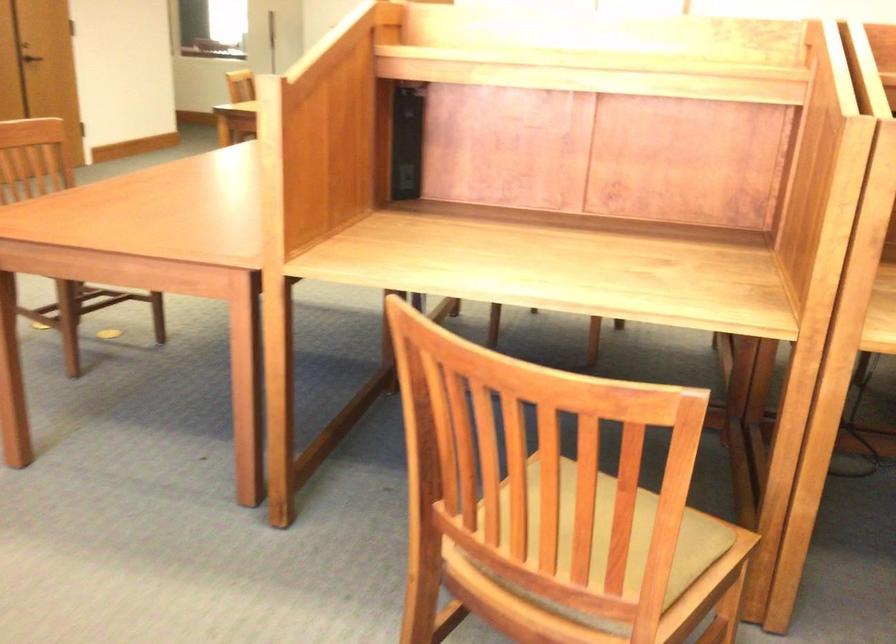
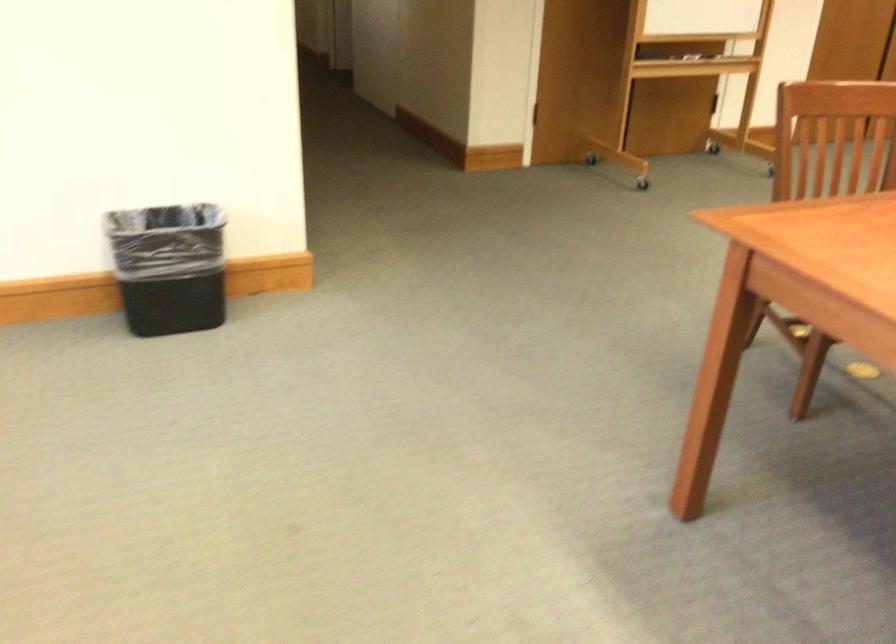
Question: Based on the continuous images, in which direction is the camera rotating? Reply with the corresponding letter.

Choices:
 (A) Left
 (B) Right
 (C) Up
 (D) Down

Answer: (A)